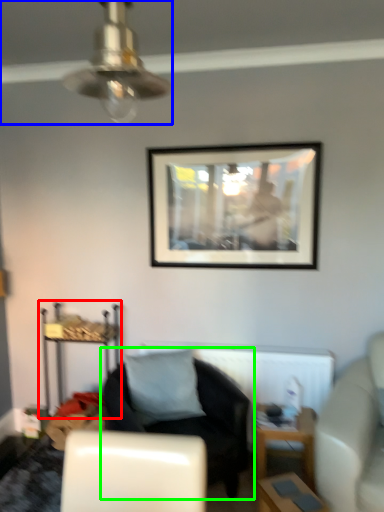
Question: Considering the real-world distances, which object is closest to dresser (highlighted by a red box)? ceiling fan (highlighted by a blue box) or chair (highlighted by a green box).

Choices:
 (A) ceiling fan
 (B) chair

Answer: (B)